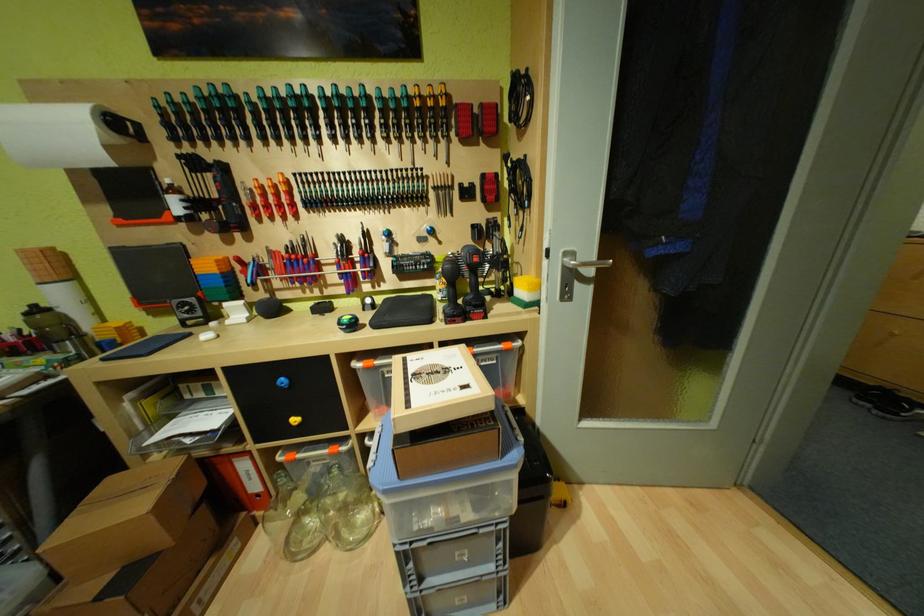
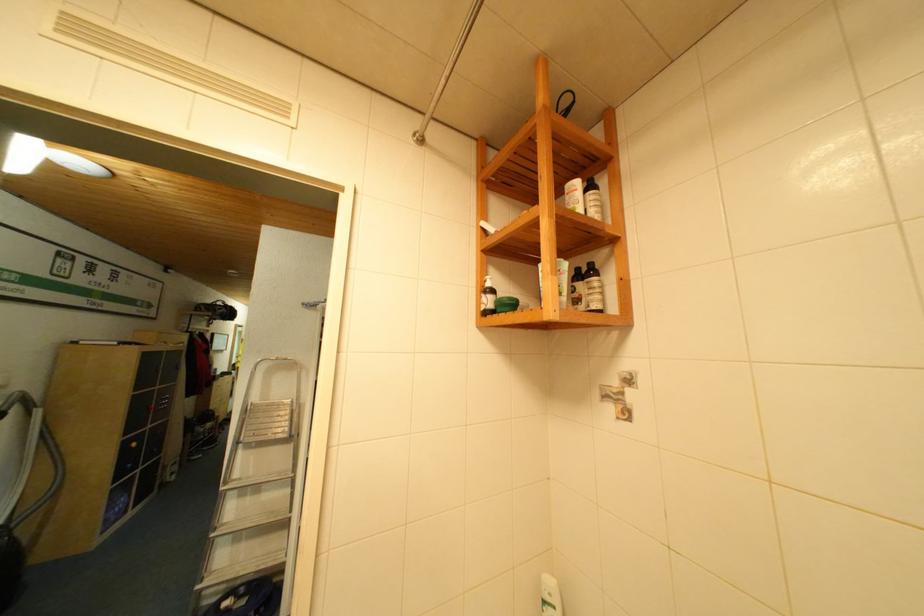
Question: I am providing you with two images of the same scene from different viewpoints. After the viewpoint changes to image2, which objects are now occluded?

Choices:
 (A) dark brown bottle
 (B) white cosmetic bottle
 (C) glass bird figurine
 (D) green screwdriver handle

Answer: (D)